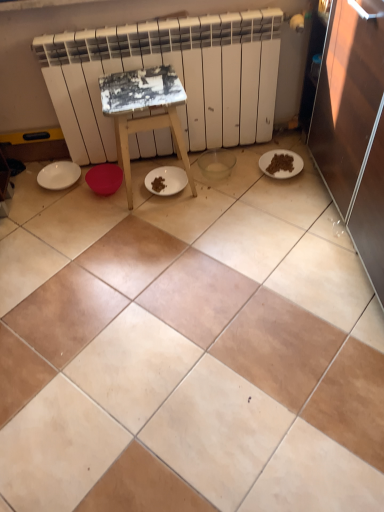
Locate an element on the screen. This screenshot has height=512, width=384. vacant area that lies to the right of white painted wood stool at center is located at coordinates (223, 183).